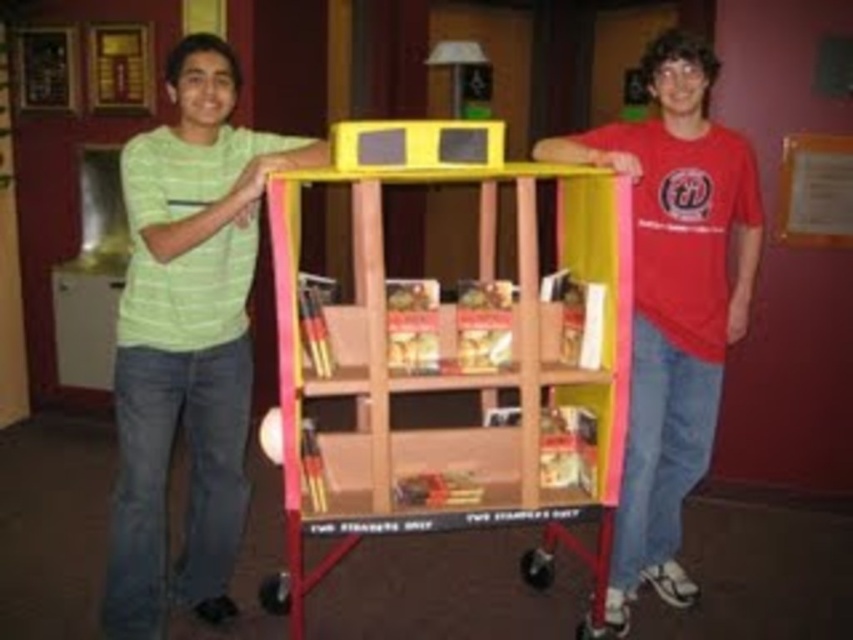
Question: Is wooden bookshelf at center thinner than green striped shirt at left?

Choices:
 (A) no
 (B) yes

Answer: (A)

Question: Does green striped shirt at left appear under matte red t-shirt at right?

Choices:
 (A) no
 (B) yes

Answer: (B)

Question: Among these objects, which one is farthest from the camera?

Choices:
 (A) green striped shirt at left
 (B) wooden bookshelf at center
 (C) matte red t-shirt at right

Answer: (C)

Question: Does wooden bookshelf at center appear on the left side of matte red t-shirt at right?

Choices:
 (A) no
 (B) yes

Answer: (B)

Question: Considering the real-world distances, which object is farthest from the green striped shirt at left?

Choices:
 (A) matte red t-shirt at right
 (B) wooden bookshelf at center

Answer: (A)

Question: Estimate the real-world distances between objects in this image. Which object is closer to the green striped shirt at left?

Choices:
 (A) matte red t-shirt at right
 (B) wooden bookshelf at center

Answer: (B)